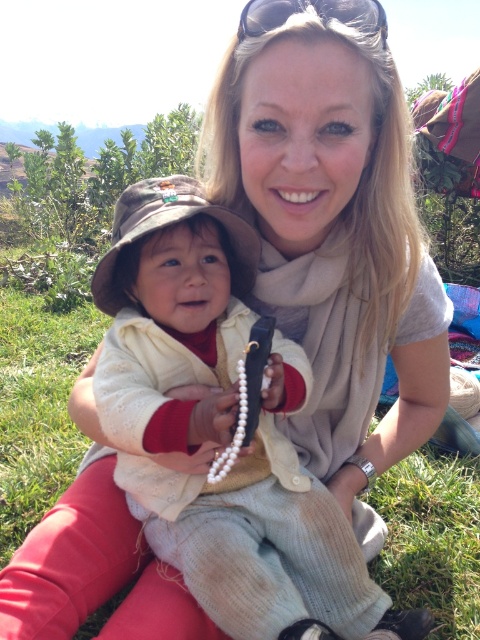
Question: Which point is closer to the camera taking this photo?

Choices:
 (A) (191, 234)
 (B) (320, 12)

Answer: (B)

Question: Which point is closer to the camera?

Choices:
 (A) (245, 33)
 (B) (226, 628)

Answer: (A)

Question: Among these objects, which one is farthest from the camera?

Choices:
 (A) black plastic sunglasses at upper center
 (B) knitted beige sweater at center

Answer: (A)

Question: Is knitted beige sweater at center above black plastic sunglasses at upper center?

Choices:
 (A) no
 (B) yes

Answer: (A)

Question: Is knitted beige sweater at center above black plastic sunglasses at upper center?

Choices:
 (A) yes
 (B) no

Answer: (B)

Question: Is knitted beige sweater at center in front of black plastic sunglasses at upper center?

Choices:
 (A) no
 (B) yes

Answer: (B)